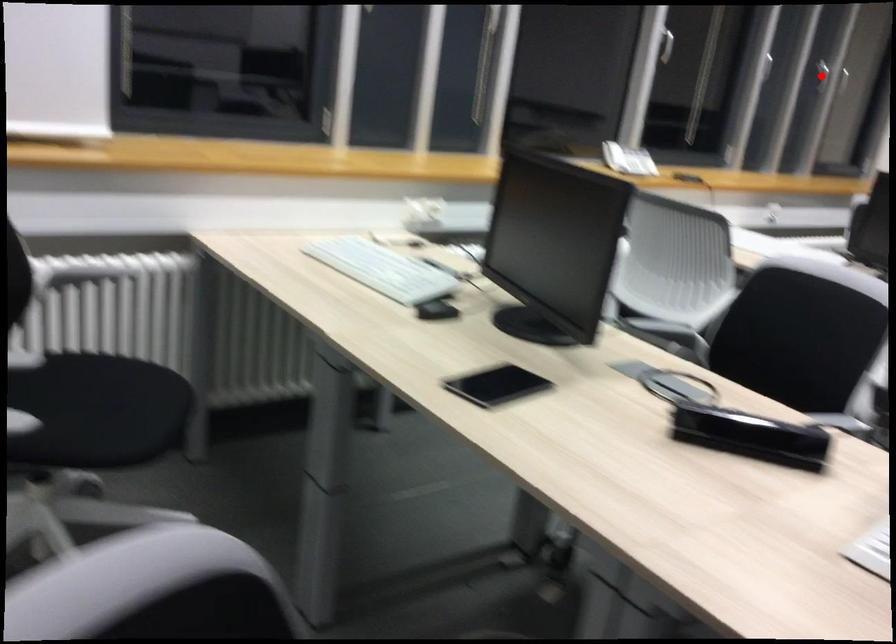
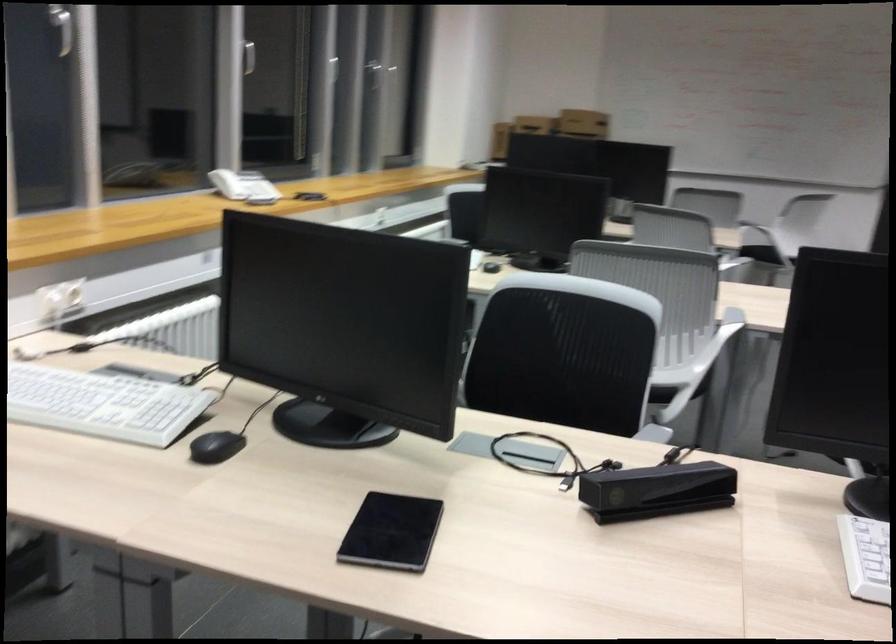
Question: I am providing you with two images of the same scene from different viewpoints. A red point is marked on the first image. Can you still see the location of the red point in image 2?

Choices:
 (A) Yes
 (B) No

Answer: (B)